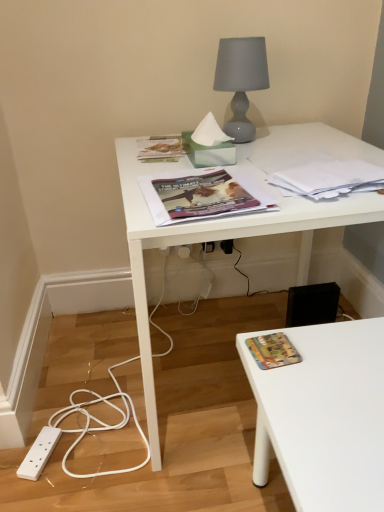
This screenshot has width=384, height=512. I want to click on free space between white glossy desk at upper center and white plastic power plugs and sockets at lower left, so click(107, 409).